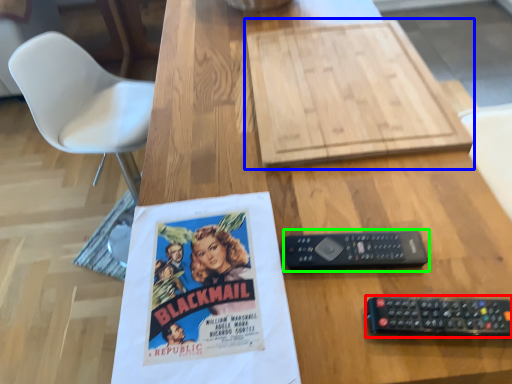
Question: Which is farther away from remote control (highlighted by a red box)? cardboard (highlighted by a blue box) or control (highlighted by a green box)?

Choices:
 (A) cardboard
 (B) control

Answer: (A)